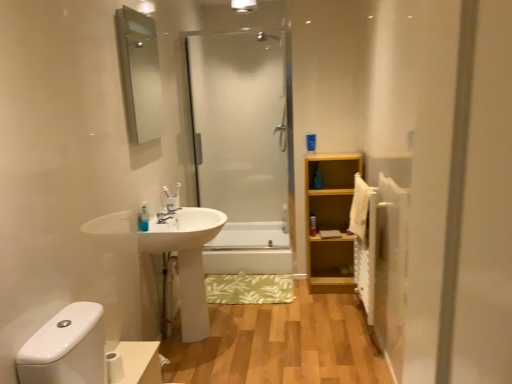
Where is `vacant space to the right of white glossy sink at center left`? vacant space to the right of white glossy sink at center left is located at coordinates (264, 320).